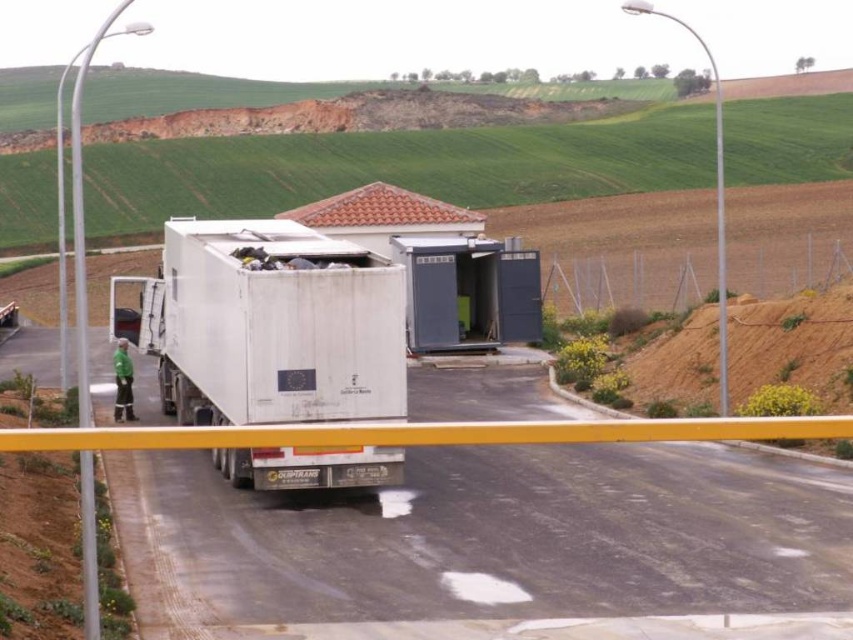
You are a delivery driver who needs to park your vehicle in a tight space at the waste management facility. Your vehicle is 10 meters long. You see the white matte truck at center and the white matte trailer truck at center. Which vehicle should you compare your vehicle length to determine if the space is suitable?

The white matte truck at center is shorter than the white matte trailer truck at center. Since your vehicle is 10 meters long, you should compare it to the white matte trailer truck at center to ensure the space can accommodate your vehicle length.